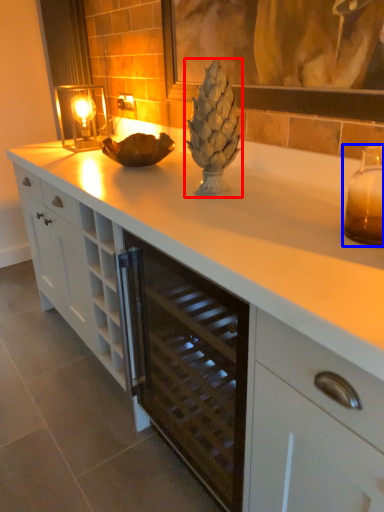
Question: Which point is further to the camera, pineapple (highlighted by a red box) or candle holder (highlighted by a blue box)?

Choices:
 (A) pineapple
 (B) candle holder

Answer: (A)